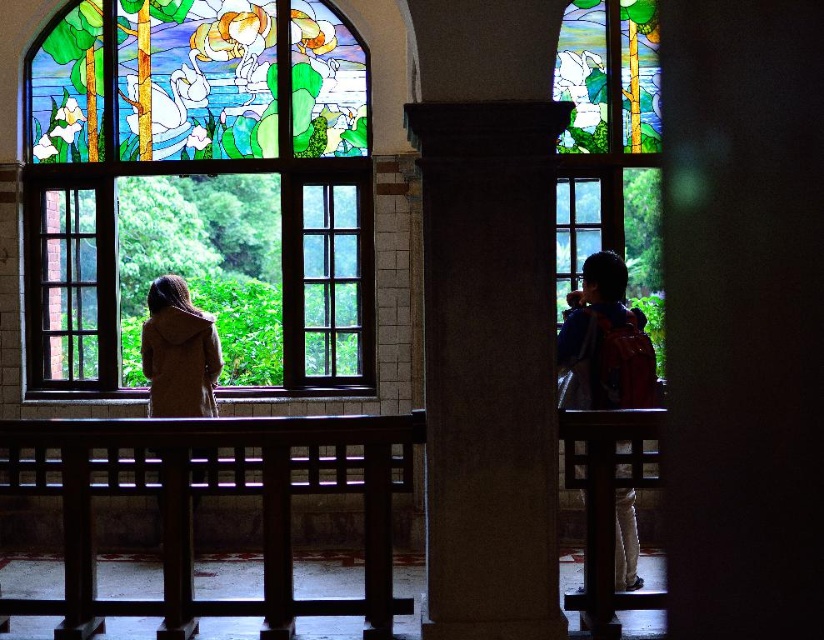
Question: Which of the following is the farthest from the observer?

Choices:
 (A) (172, 330)
 (B) (158, 156)
 (C) (199, 448)

Answer: (B)

Question: Which of the following is the farthest from the observer?

Choices:
 (A) (97, 228)
 (B) (591, 529)

Answer: (A)

Question: Which is farther from the blue denim jacket at right?

Choices:
 (A) brown textured coat at left
 (B) stained glass window at right
 (C) smooth stone pillar at center

Answer: (A)

Question: Can you confirm if wooden bench at lower right is smaller than brown textured coat at left?

Choices:
 (A) yes
 (B) no

Answer: (B)

Question: Is smooth stone pillar at center above brown textured coat at left?

Choices:
 (A) yes
 (B) no

Answer: (A)

Question: Does wooden bench at lower right appear on the right side of brown textured coat at left?

Choices:
 (A) yes
 (B) no

Answer: (A)